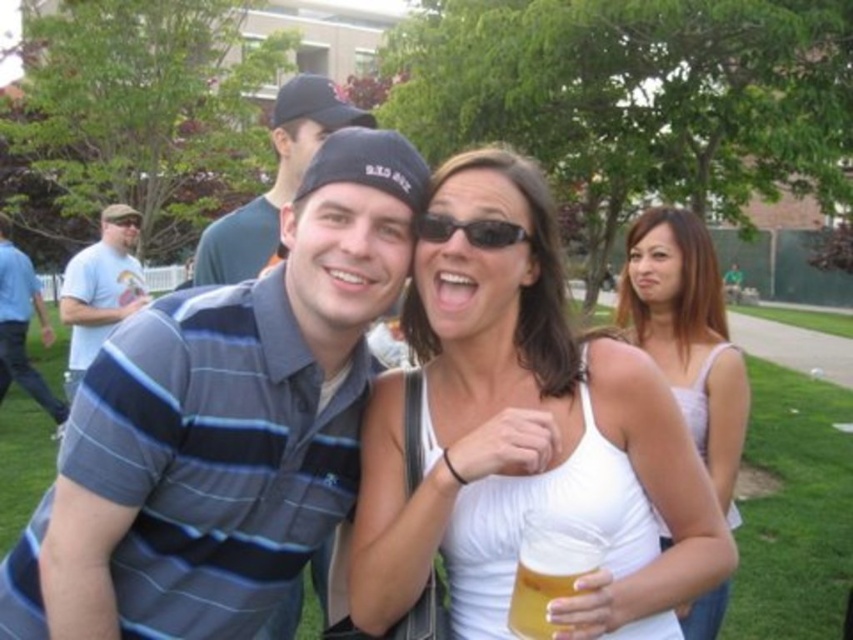
Between white fabric tank top at upper right and blue striped shirt at center, which one has more height?

white fabric tank top at upper right

Is point (688, 220) farther from viewer compared to point (241, 250)?

Yes.

In order to click on white fabric tank top at upper right in this screenshot , I will do `click(688, 336)`.

Who is positioned more to the right, white matte tank top at center or blue striped polo shirt at left?

white matte tank top at center is more to the right.

Who is lower down, white matte tank top at center or blue striped polo shirt at left?

Positioned lower is white matte tank top at center.

Which is in front, point (364, 596) or point (15, 248)?

Point (364, 596) is in front.

I want to click on white matte tank top at center, so click(521, 433).

Does point (424, 289) come closer to viewer compared to point (553, 588)?

No, (424, 289) is further to viewer.

Is point (534, 243) closer to camera compared to point (514, 604)?

No, it is not.

Where is `white matte tank top at center`? This screenshot has height=640, width=853. white matte tank top at center is located at coordinates (521, 433).